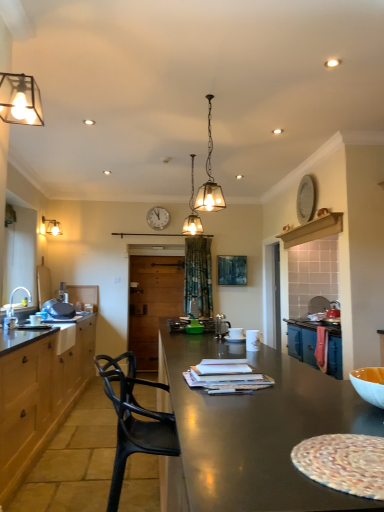
Measure the distance between wooden cabinets at left and camera.

They are 7.61 feet apart.

Image resolution: width=384 pixels, height=512 pixels. I want to click on wooden cabinets at left, so click(x=40, y=394).

This screenshot has height=512, width=384. I want to click on white glossy sink at left, so click(13, 309).

What do you see at coordinates (134, 420) in the screenshot? I see `black plastic chair at center` at bounding box center [134, 420].

This screenshot has height=512, width=384. Describe the element at coordinates (20, 100) in the screenshot. I see `matte glass lamp at upper left, arranged as the 2th lamp when viewed from the left` at that location.

Find the location of a particular element. The height and width of the screenshot is (512, 384). wooden cabinets at left is located at coordinates (40, 394).

Could you tell me if matte glass lampshade at upper left, which is the 1th lamp in left-to-right order, is turned towards matte brown countertop at left?

No, matte glass lampshade at upper left, which is the 1th lamp in left-to-right order, is not aimed at matte brown countertop at left.

Where is `lamp that is the 2nd object located behind the matte brown countertop at left`? The image size is (384, 512). lamp that is the 2nd object located behind the matte brown countertop at left is located at coordinates (50, 227).

Which is more to the left, satin silver coffee pot at center or matte glass lampshade at upper left, which is the 1th lamp in left-to-right order?

Positioned to the left is matte glass lampshade at upper left, which is the 1th lamp in left-to-right order.

From the image's perspective, is satin silver coffee pot at center over matte glass lampshade at upper left, which is the first lamp from back to front?

No, from the image's perspective, satin silver coffee pot at center is not on top of matte glass lampshade at upper left, which is the first lamp from back to front.

From a real-world perspective, is satin silver coffee pot at center located higher than matte glass lampshade at upper left, the 4th lamp from the front?

Incorrect, from a real-world perspective, satin silver coffee pot at center is lower than matte glass lampshade at upper left, the 4th lamp from the front.

Which point is more forward, (224, 335) or (60, 232)?

The point (224, 335) is in front.

Considering the positions of objects matte glass pendant light at center, the 3th lamp positioned from the back, and matte brown countertop at left in the image provided, who is in front, matte glass pendant light at center, the 3th lamp positioned from the back, or matte brown countertop at left?

matte glass pendant light at center, the 3th lamp positioned from the back, is in front.

From the image's perspective, is matte glass pendant light at center, positioned as the 1th lamp in right-to-left order, located above or below matte brown countertop at left?

matte glass pendant light at center, positioned as the 1th lamp in right-to-left order, is above matte brown countertop at left.

In the image, there is a matte glass pendant light at center, the 2th lamp from the front. Identify the location of counter top below it (from the image's perspective). (23, 337).

Does matte glass pendant light at center, the 2th lamp from the front, have a greater width compared to white glossy sink at left?

In fact, matte glass pendant light at center, the 2th lamp from the front, might be narrower than white glossy sink at left.

Considering the relative positions of matte glass pendant light at center, acting as the 4th lamp starting from the left, and white glossy sink at left in the image provided, is matte glass pendant light at center, acting as the 4th lamp starting from the left, to the left of white glossy sink at left from the viewer's perspective?

In fact, matte glass pendant light at center, acting as the 4th lamp starting from the left, is to the right of white glossy sink at left.

In the scene shown: Is matte glass pendant light at center, positioned as the 1th lamp in right-to-left order, oriented away from white glossy sink at left?

matte glass pendant light at center, positioned as the 1th lamp in right-to-left order, is not turned away from white glossy sink at left.

Is matte glass pendant light at center, acting as the 4th lamp starting from the left, positioned far away from white glossy sink at left?

Absolutely, matte glass pendant light at center, acting as the 4th lamp starting from the left, is distant from white glossy sink at left.

Is satin silver coffee pot at center completely or partially outside of matte glass pendant light at center, acting as the 4th lamp starting from the left?

Yes, satin silver coffee pot at center is outside of matte glass pendant light at center, acting as the 4th lamp starting from the left.

Find the location of a particular element. This screenshot has height=512, width=384. appliance that appears below the matte glass pendant light at center, acting as the 4th lamp starting from the left (from the image's perspective) is located at coordinates (221, 326).

From a real-world perspective, which is physically above, satin silver coffee pot at center or matte glass pendant light at center, acting as the 4th lamp starting from the left?

matte glass pendant light at center, acting as the 4th lamp starting from the left, is physically above.

Is point (204, 200) positioned in front of point (147, 223)?

That is True.

Can you confirm if matte glass pendant light at center, positioned as the 1th lamp in right-to-left order, is positioned to the left of white wooden clock at upper center?

Incorrect, matte glass pendant light at center, positioned as the 1th lamp in right-to-left order, is not on the left side of white wooden clock at upper center.

Considering the sizes of objects matte glass pendant light at center, positioned as the 1th lamp in right-to-left order, and white wooden clock at upper center in the image provided, who is wider, matte glass pendant light at center, positioned as the 1th lamp in right-to-left order, or white wooden clock at upper center?

matte glass pendant light at center, positioned as the 1th lamp in right-to-left order, is wider.

From the image's perspective, is matte glass pendant light at center, positioned as the 1th lamp in right-to-left order, located above white wooden clock at upper center?

Correct, matte glass pendant light at center, positioned as the 1th lamp in right-to-left order, appears higher than white wooden clock at upper center in the image.

From the image's perspective, relative to matte glass pendant light at center, positioned as the 1th lamp in right-to-left order, is black plastic chair at center above or below?

black plastic chair at center is situated lower than matte glass pendant light at center, positioned as the 1th lamp in right-to-left order, in the image.

Between black plastic chair at center and matte glass pendant light at center, the 3th lamp positioned from the back, which one has more height?

matte glass pendant light at center, the 3th lamp positioned from the back.

Considering the relative sizes of black plastic chair at center and matte glass pendant light at center, acting as the 4th lamp starting from the left, in the image provided, is black plastic chair at center wider than matte glass pendant light at center, acting as the 4th lamp starting from the left,?

Correct, the width of black plastic chair at center exceeds that of matte glass pendant light at center, acting as the 4th lamp starting from the left.

Can you tell me how much black plastic chair at center and matte glass pendant light at center, the 2th lamp from the front, differ in facing direction?

The angular difference between black plastic chair at center and matte glass pendant light at center, the 2th lamp from the front, is 107 degrees.

Where is `counter top on the right of matte glass lampshade at upper left, which is the first lamp from back to front`? This screenshot has width=384, height=512. counter top on the right of matte glass lampshade at upper left, which is the first lamp from back to front is located at coordinates (23, 337).

Locate an element on the screen. The width and height of the screenshot is (384, 512). appliance below the matte glass lampshade at upper left, acting as the fourth lamp starting from the right (from the image's perspective) is located at coordinates (221, 326).

Based on their spatial positions, is translucent glass pendant light at center, which ranks as the third lamp in front-to-back order, or matte brown countertop at left closer to matte glass lamp at upper left, arranged as the 2th lamp when viewed from the left?

matte brown countertop at left is closer to matte glass lamp at upper left, arranged as the 2th lamp when viewed from the left.

Considering their positions, is white glossy sink at left positioned further to translucent glass pendant light at center, positioned as the 3th lamp in left-to-right order, than satin silver coffee pot at center?

Among the two, white glossy sink at left is located further to translucent glass pendant light at center, positioned as the 3th lamp in left-to-right order.

Which object lies further to the anchor point white wooden clock at upper center, translucent glass pendant light at center, positioned as the 3th lamp in left-to-right order, or white glossy sink at left?

white glossy sink at left is further to white wooden clock at upper center.

From the image, which object appears to be farther from white wooden clock at upper center, satin silver coffee pot at center or black plastic chair at center?

Based on the image, black plastic chair at center appears to be further to white wooden clock at upper center.

Considering their positions, is wooden cabinets at left positioned further to matte glass lampshade at upper left, acting as the fourth lamp starting from the right, than white glossy sink at left?

The object further to matte glass lampshade at upper left, acting as the fourth lamp starting from the right, is wooden cabinets at left.

Considering their positions, is matte glass pendant light at center, the 2th lamp from the front, positioned closer to matte brown countertop at left than translucent glass pendant light at center, which ranks as the third lamp in front-to-back order?

matte glass pendant light at center, the 2th lamp from the front, is positioned closer to the anchor matte brown countertop at left.

From the image, which object appears to be farther from wooden cabinets at left, translucent glass pendant light at center, acting as the second lamp starting from the back, or satin silver coffee pot at center?

translucent glass pendant light at center, acting as the second lamp starting from the back, is further to wooden cabinets at left.

Based on their spatial positions, is matte glass lampshade at upper left, which is the 1th lamp in left-to-right order, or black plastic chair at center closer to white glossy sink at left?

The object closer to white glossy sink at left is black plastic chair at center.

Locate an element on the screen. This screenshot has width=384, height=512. sink between matte glass lampshade at upper left, acting as the fourth lamp starting from the right, and translucent glass pendant light at center, acting as the second lamp starting from the back, in the horizontal direction is located at coordinates (13, 309).

Identify the location of lamp between matte glass pendant light at center, the 3th lamp positioned from the back, and matte glass lampshade at upper left, the 4th lamp from the front, along the z-axis. (192, 210).

Find the location of a particular element. Image resolution: width=384 pixels, height=512 pixels. cabinetry situated between white glossy sink at left and satin silver coffee pot at center from left to right is located at coordinates (40, 394).

Where is `lamp between translucent glass pendant light at center, which ranks as the third lamp in front-to-back order, and white wooden clock at upper center from front to back`? The image size is (384, 512). lamp between translucent glass pendant light at center, which ranks as the third lamp in front-to-back order, and white wooden clock at upper center from front to back is located at coordinates (50, 227).